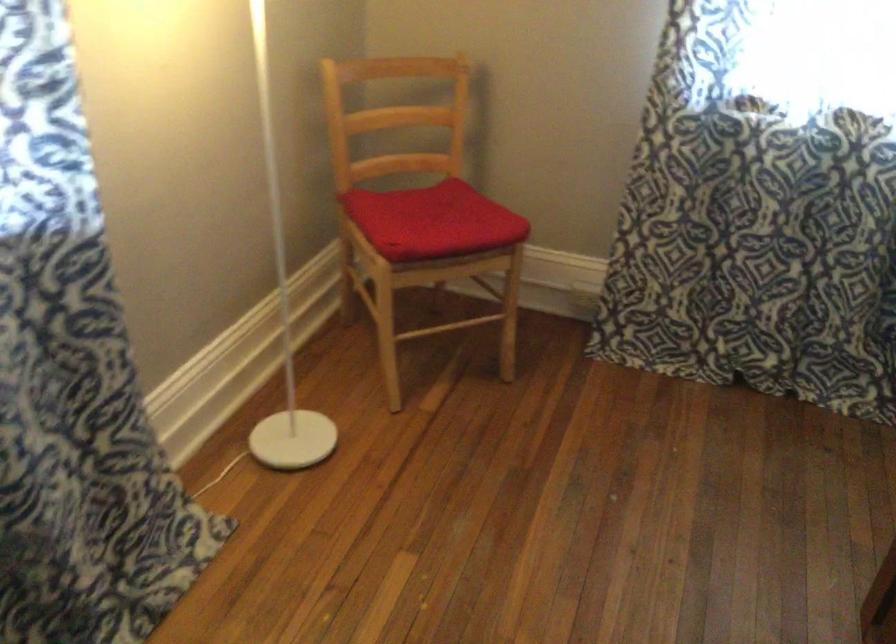
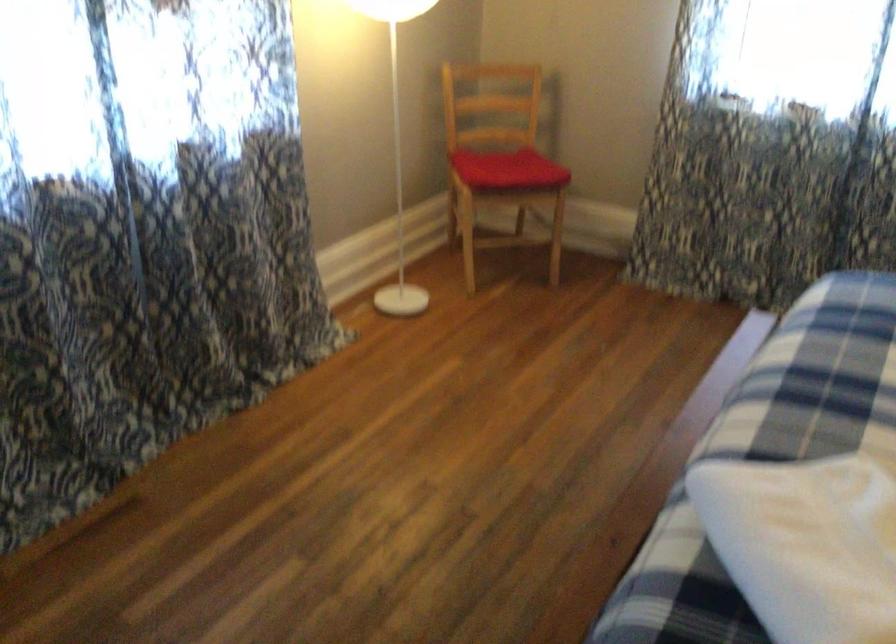
The point at (436, 227) is marked in the first image. Where is the corresponding point in the second image?

(507, 169)